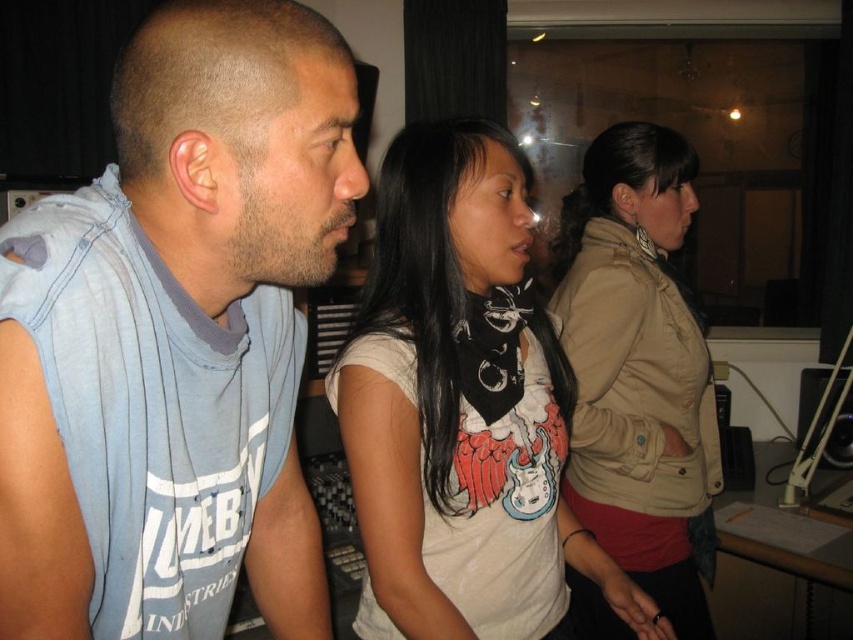
Question: Does light blue sleeveless shirt at left appear over white matte t-shirt at center?

Choices:
 (A) no
 (B) yes

Answer: (B)

Question: Which of the following is the closest to the observer?

Choices:
 (A) (479, 532)
 (B) (595, 212)
 (C) (154, 397)

Answer: (C)

Question: Which point is farther from the camera taking this photo?

Choices:
 (A) (71, 228)
 (B) (618, 198)
 (C) (405, 513)

Answer: (B)

Question: Based on their relative distances, which object is farther from the light blue sleeveless shirt at left?

Choices:
 (A) white matte t-shirt at center
 (B) tan leather jacket at center

Answer: (B)

Question: Does light blue sleeveless shirt at left appear on the right side of white matte t-shirt at center?

Choices:
 (A) yes
 (B) no

Answer: (B)

Question: Does light blue sleeveless shirt at left have a lesser width compared to tan leather jacket at center?

Choices:
 (A) yes
 (B) no

Answer: (A)